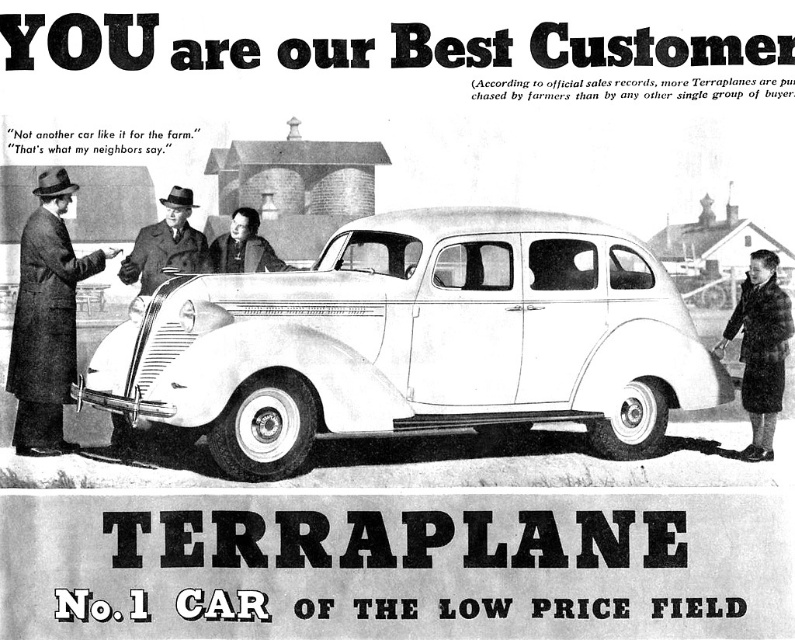
Which is below, dark brown coat at left or dark brown fur coat at lower right?

dark brown fur coat at lower right is below.

Between dark brown coat at left and dark brown fur coat at lower right, which one has less height?

Standing shorter between the two is dark brown fur coat at lower right.

Is point (68, 380) positioned before point (761, 440)?

No.

Where is `dark brown coat at left`? The image size is (795, 640). dark brown coat at left is located at coordinates (45, 317).

In the scene shown: Between white matte sedan at center and matte black coat at center, which one has more height?

Standing taller between the two is white matte sedan at center.

Does white matte sedan at center lie behind matte black coat at center?

No, white matte sedan at center is closer to the viewer.

Where is `white matte sedan at center`? The width and height of the screenshot is (795, 640). white matte sedan at center is located at coordinates (415, 340).

Does matte black coat at center have a smaller size compared to smooth leather jacket at center?

Actually, matte black coat at center might be larger than smooth leather jacket at center.

Locate an element on the screen. matte black coat at center is located at coordinates (165, 244).

Where is `matte black coat at center`? The image size is (795, 640). matte black coat at center is located at coordinates (165, 244).